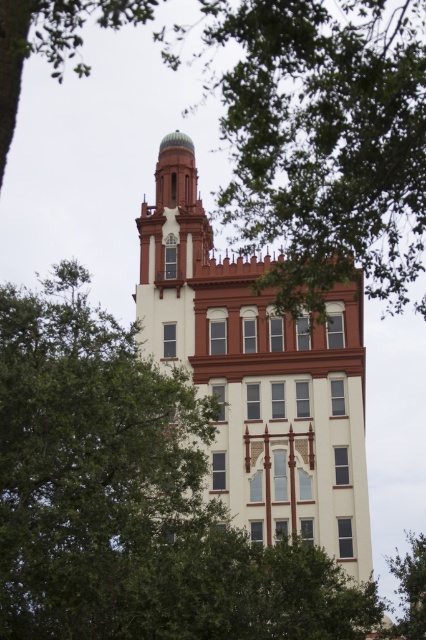
Question: In this image, where is white painted brick tower at center located relative to green leafy tree at lower right?

Choices:
 (A) left
 (B) right

Answer: (A)

Question: Can you confirm if white painted brick tower at center is positioned below green leafy tree at lower right?

Choices:
 (A) no
 (B) yes

Answer: (A)

Question: Which point is farther from the camera taking this photo?

Choices:
 (A) (423, 564)
 (B) (227, 493)

Answer: (A)

Question: Among these points, which one is farthest from the camera?

Choices:
 (A) (166, 138)
 (B) (425, 588)

Answer: (A)

Question: Is white painted brick tower at center thinner than green leafy tree at lower right?

Choices:
 (A) yes
 (B) no

Answer: (B)